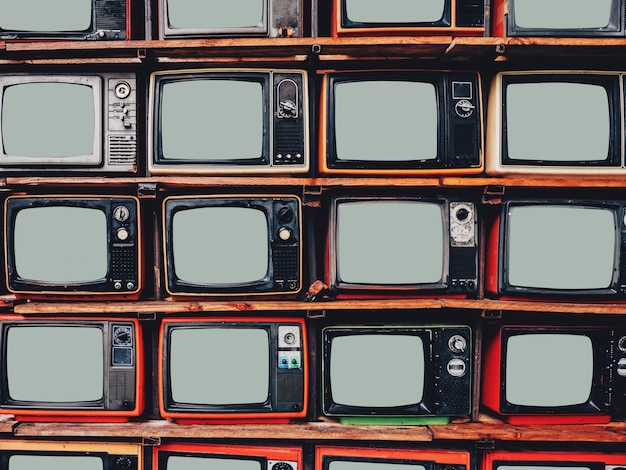
Identify the location of shelf. (232, 430), (245, 308), (233, 178), (239, 46).